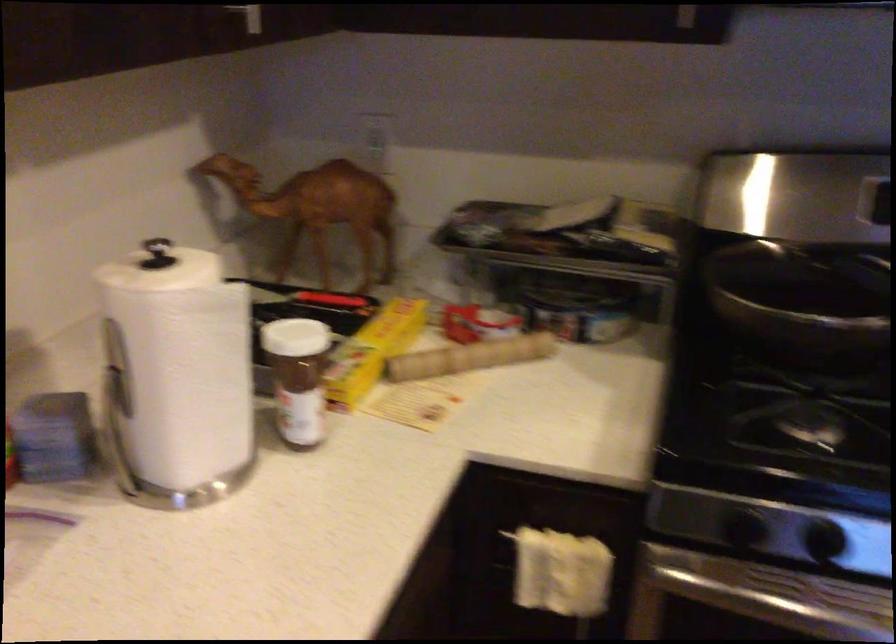
You are a GUI agent. You are given a task and a screenshot of the screen. Output one action in this format:
    pyautogui.click(x=<x>, y=<y>)
    Task: Click on the paper towel holder knob
    Image resolution: width=896 pixels, height=644 pixels.
    Given the screenshot: What is the action you would take?
    pyautogui.click(x=157, y=252)